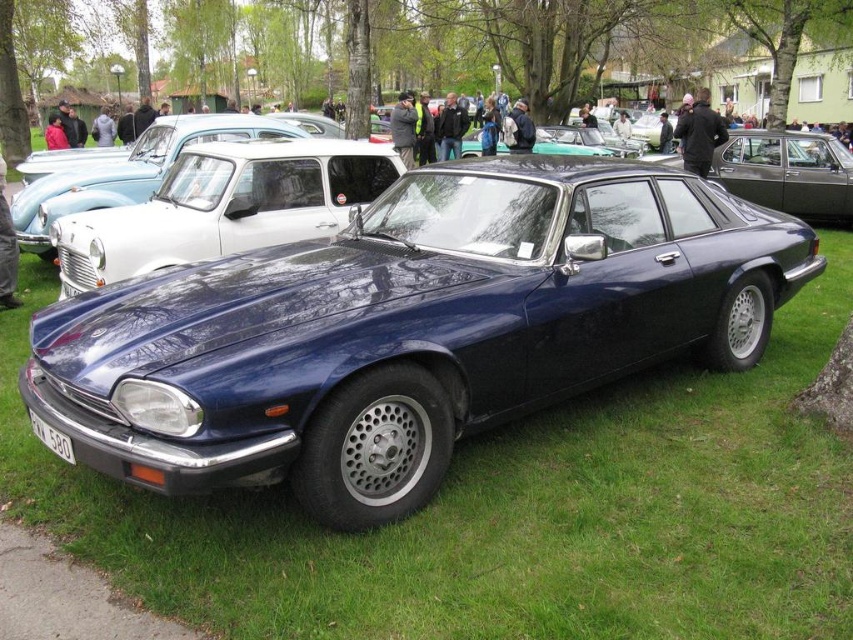
Question: Which of the following is the closest to the observer?

Choices:
 (A) glossy blue car at center
 (B) white plastic license plate at lower left
 (C) green textured tree at center

Answer: (A)

Question: Which point appears closest to the camera in this image?

Choices:
 (A) (779, 97)
 (B) (585, 282)

Answer: (B)

Question: Can you confirm if glossy blue car at center is smaller than white plastic license plate at lower left?

Choices:
 (A) no
 (B) yes

Answer: (A)

Question: Which of these objects is positioned farthest from the green textured tree at center?

Choices:
 (A) glossy blue car at center
 (B) glossy blue sedan at center
 (C) white plastic license plate at lower left

Answer: (C)

Question: Where is glossy blue car at center located in relation to white plastic license plate at lower left in the image?

Choices:
 (A) right
 (B) left

Answer: (A)

Question: Is green textured tree at center thinner than white plastic license plate at lower left?

Choices:
 (A) no
 (B) yes

Answer: (A)